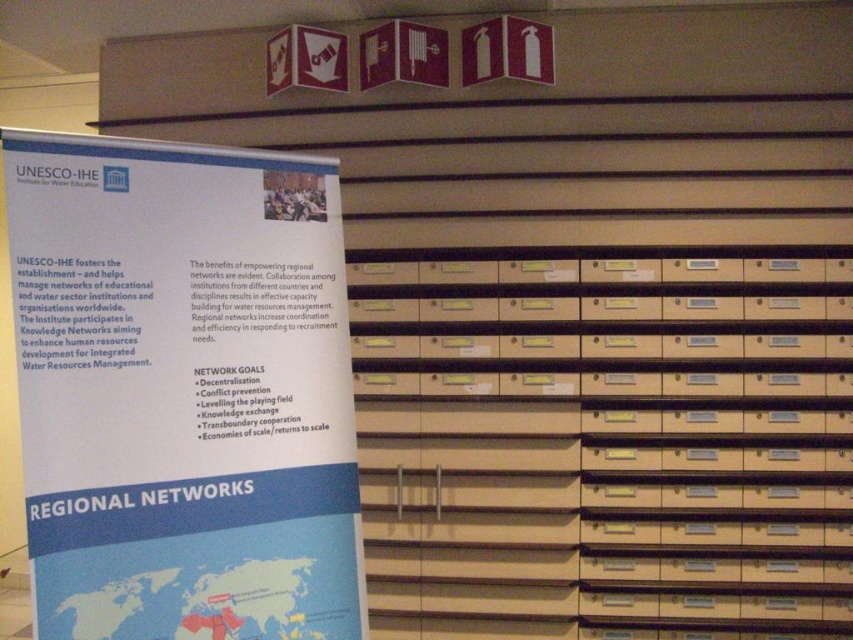
Locate an element on the screen. Image resolution: width=853 pixels, height=640 pixels. beige cardboard drawers at center is located at coordinates (605, 440).

Can you confirm if beige cardboard drawers at center is smaller than white paper poster at left?

Incorrect, beige cardboard drawers at center is not smaller in size than white paper poster at left.

Is point (844, 621) behind point (189, 262)?

Yes.

The height and width of the screenshot is (640, 853). What are the coordinates of `beige cardboard drawers at center` in the screenshot? It's located at (605, 440).